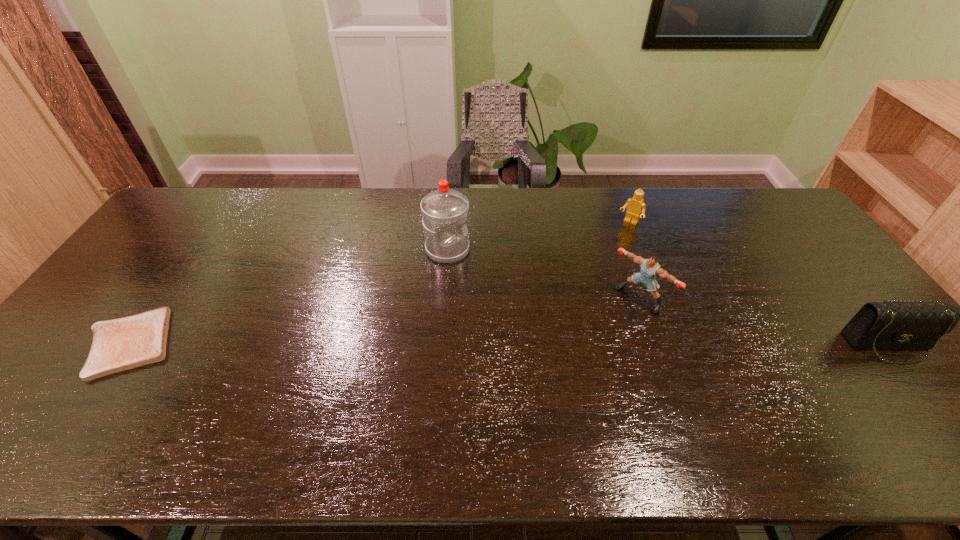
Locate an element on the screen. object that ranks as the second closest to the farthest object is located at coordinates (444, 211).

Locate an element on the screen. vacant area in the image that satisfies the following two spatial constraints: 1. on the back side of the puncher; 2. on the left side of the shortest object is located at coordinates (160, 298).

Identify the location of vacant position in the image that satisfies the following two spatial constraints: 1. on the back side of the fourth object from right to left; 2. on the left side of the farthest object. The image size is (960, 540). (449, 222).

Where is `free location that satisfies the following two spatial constraints: 1. on the back side of the farthest object; 2. on the right side of the shortest object`? free location that satisfies the following two spatial constraints: 1. on the back side of the farthest object; 2. on the right side of the shortest object is located at coordinates (212, 222).